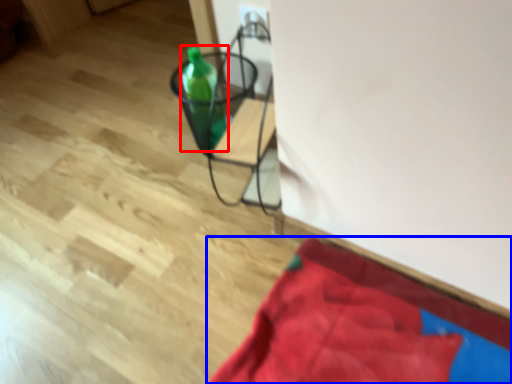
Question: Which of the following is the farthest to the observer, bottle (highlighted by a red box) or blanket (highlighted by a blue box)?

Choices:
 (A) bottle
 (B) blanket

Answer: (A)